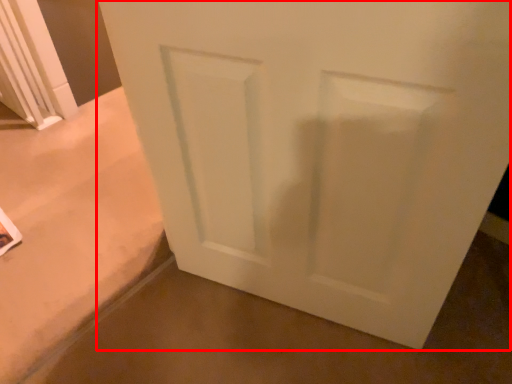
Question: From the image's perspective, where is door (annotated by the red box) located relative to concrete?

Choices:
 (A) above
 (B) below

Answer: (A)